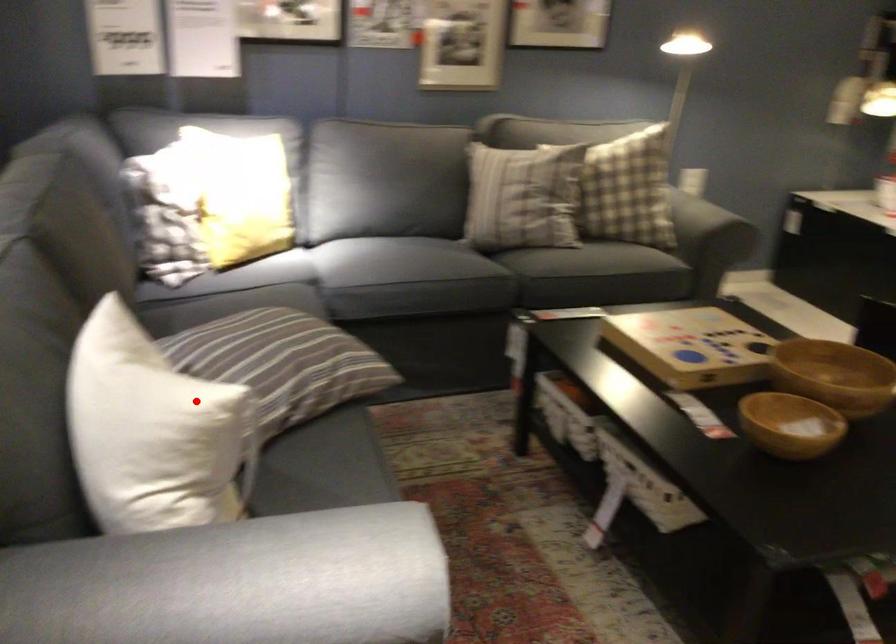
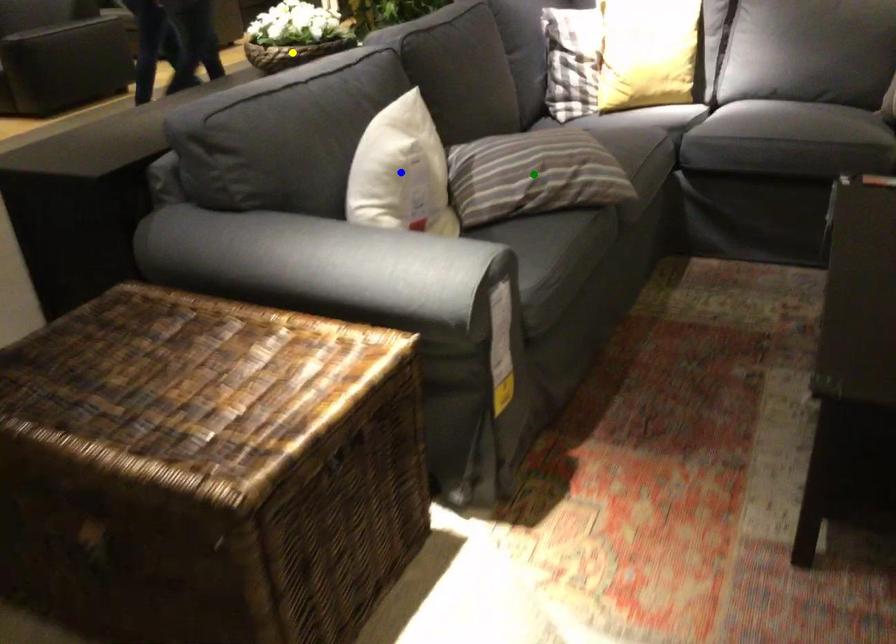
Question: I am providing you with two images of the same scene from different viewpoints. A red point is marked on the first image. You are given multiple points on the second image. Which point in image 2 represents the same 3d spot as the red point in image 1?

Choices:
 (A) blue point
 (B) yellow point
 (C) green point

Answer: (A)